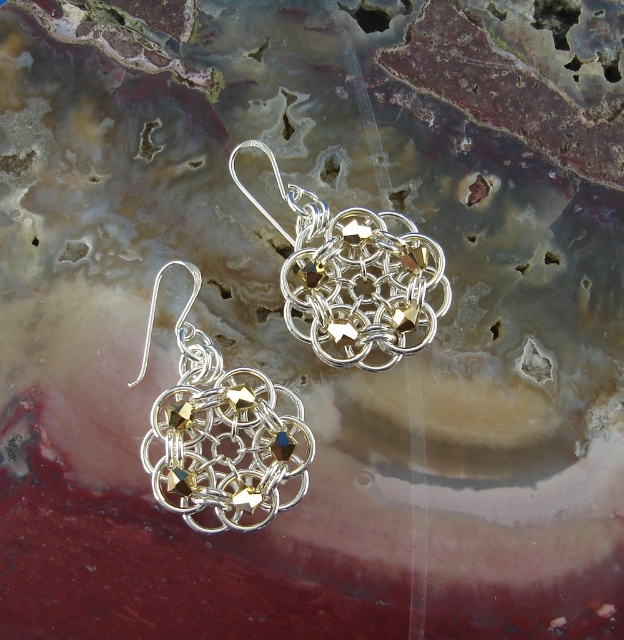
Is point (278, 492) positioned before point (334, 364)?

Yes, point (278, 492) is closer to viewer.

Based on the photo, who is positioned more to the left, silver/golden wire mesh earring at center or silver/golden wirework earring at center?

From the viewer's perspective, silver/golden wire mesh earring at center appears more on the left side.

The width and height of the screenshot is (624, 640). What do you see at coordinates (222, 433) in the screenshot? I see `silver/golden wire mesh earring at center` at bounding box center [222, 433].

Locate an element on the screen. The height and width of the screenshot is (640, 624). silver/golden wire mesh earring at center is located at coordinates (222, 433).